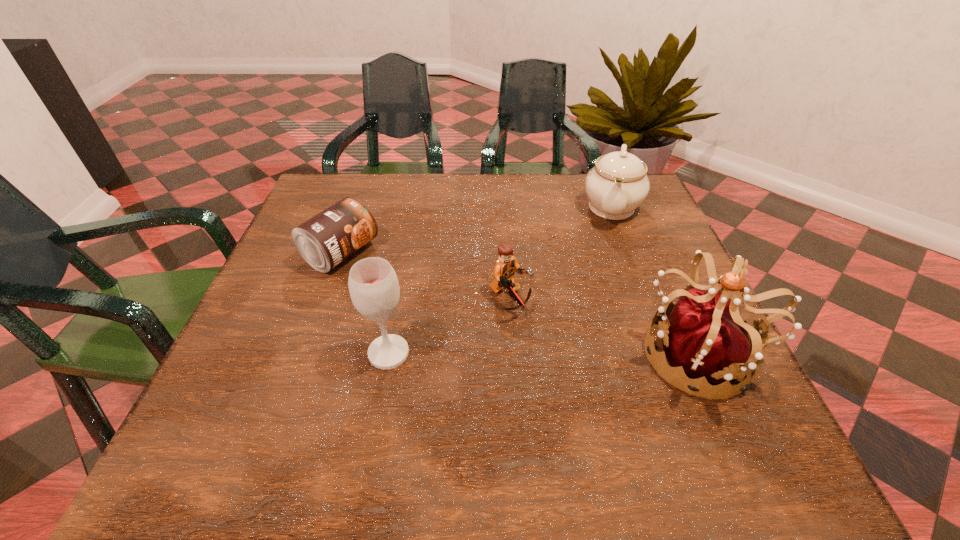
Where is `object that is at the left edge`? This screenshot has width=960, height=540. object that is at the left edge is located at coordinates (328, 238).

Image resolution: width=960 pixels, height=540 pixels. In order to click on tiara positioned at the right edge in this screenshot , I will do `click(704, 336)`.

You are a GUI agent. You are given a task and a screenshot of the screen. Output one action in this format:
    pyautogui.click(x=<x>, y=<y>)
    Task: Click on the chinaware located in the right edge section of the desktop
    
    Given the screenshot: What is the action you would take?
    pyautogui.click(x=617, y=184)

Where is `object at the far right corner`? object at the far right corner is located at coordinates (617, 184).

This screenshot has width=960, height=540. Find the location of `object that is positioned at the near right corner`. object that is positioned at the near right corner is located at coordinates (704, 336).

In the image, there is a desktop. At what (x,y) coordinates should I click in order to perform the action: click on vacant area at the far edge. Please return your answer as a coordinate pair (x, y). Image resolution: width=960 pixels, height=540 pixels. Looking at the image, I should click on (505, 220).

Where is `vacant region at the near edge of the desktop`? The width and height of the screenshot is (960, 540). vacant region at the near edge of the desktop is located at coordinates (360, 382).

The width and height of the screenshot is (960, 540). In the image, there is a desktop. Identify the location of vacant space at the left edge. (269, 317).

Where is `vacant region at the right edge of the desktop`? Image resolution: width=960 pixels, height=540 pixels. vacant region at the right edge of the desktop is located at coordinates (636, 223).

Identify the location of vacant area that lies between the second object from left to right and the tiara. (545, 353).